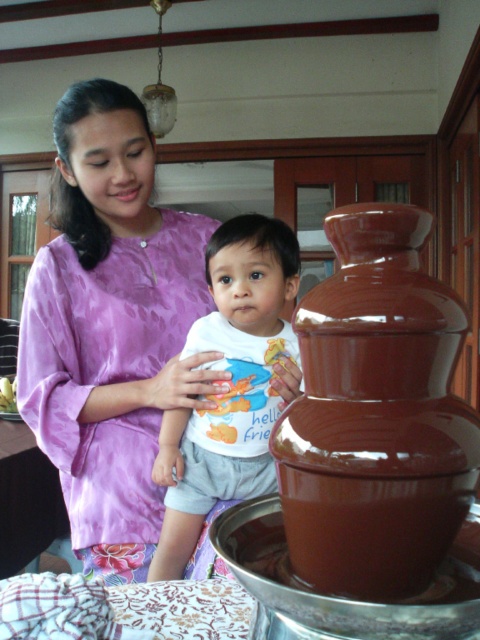
Does purple satin dress at upper left come in front of white cotton shirt at center?

Yes, purple satin dress at upper left is closer to the viewer.

Does purple satin dress at upper left appear under white cotton shirt at center?

No.

Locate an element on the screen. purple satin dress at upper left is located at coordinates (110, 326).

Can you confirm if shiny brown chocolate fountain at right is positioned above white cotton shirt at center?

Yes, shiny brown chocolate fountain at right is above white cotton shirt at center.

In the scene shown: Can you confirm if shiny brown chocolate fountain at right is positioned below white cotton shirt at center?

No, shiny brown chocolate fountain at right is not below white cotton shirt at center.

Between point (459, 484) and point (191, 531), which one is positioned in front?

Point (459, 484)

The height and width of the screenshot is (640, 480). I want to click on shiny brown chocolate fountain at right, so click(375, 413).

Can you confirm if purple satin dress at upper left is thinner than shiny brown chocolate fountain at right?

No.

Can you confirm if purple satin dress at upper left is wider than shiny brown chocolate fountain at right?

Correct, the width of purple satin dress at upper left exceeds that of shiny brown chocolate fountain at right.

Is point (96, 234) positioned after point (344, 282)?

That is True.

The width and height of the screenshot is (480, 640). Identify the location of purple satin dress at upper left. (110, 326).